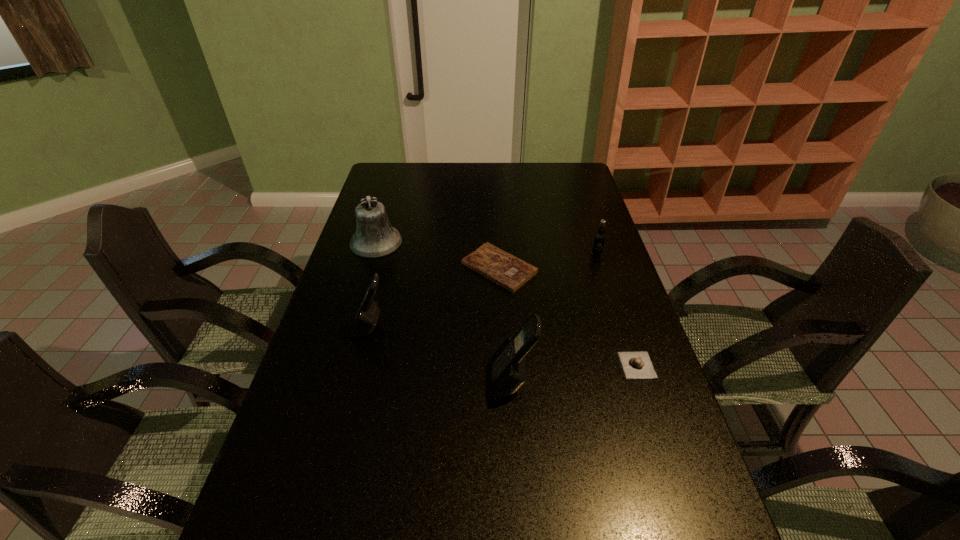
Image resolution: width=960 pixels, height=540 pixels. Identify the location of vacant spot to place a cellular telephone on the right. [x=691, y=454].